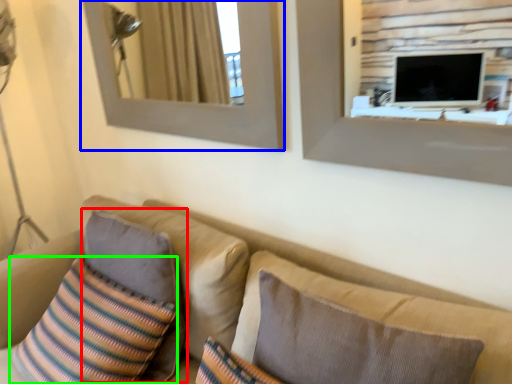
Question: Which is nearer to the pillow (highlighted by a red box)? picture frame (highlighted by a blue box) or throw pillow (highlighted by a green box).

Choices:
 (A) picture frame
 (B) throw pillow

Answer: (B)